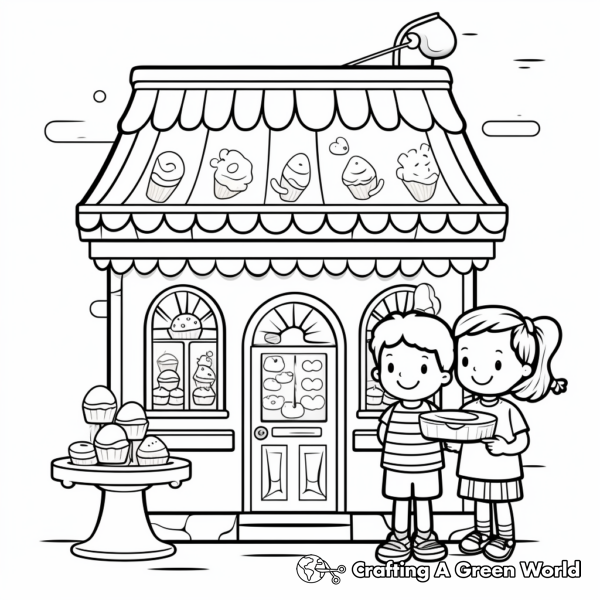
Find the location of a particular element. The image size is (600, 600). stand is located at coordinates (129, 519).